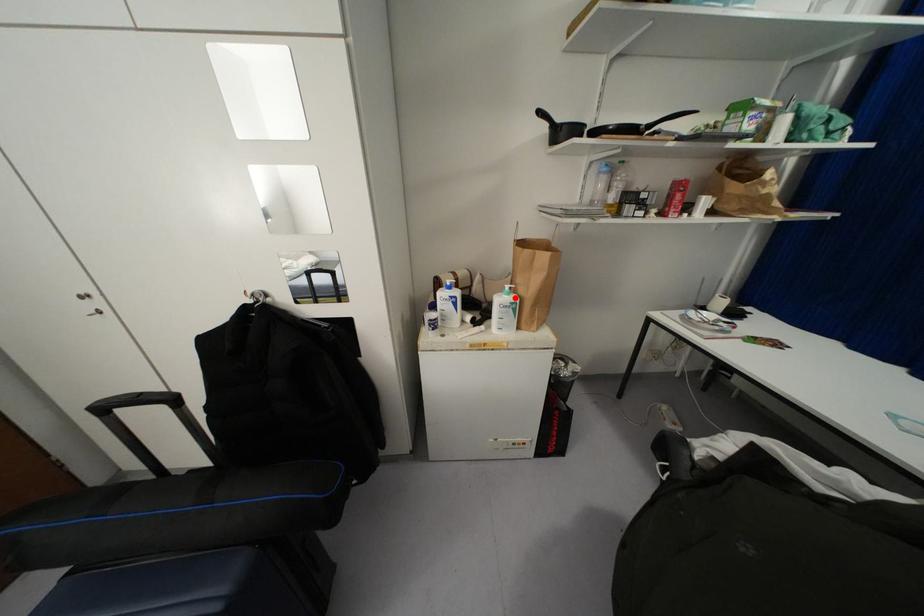
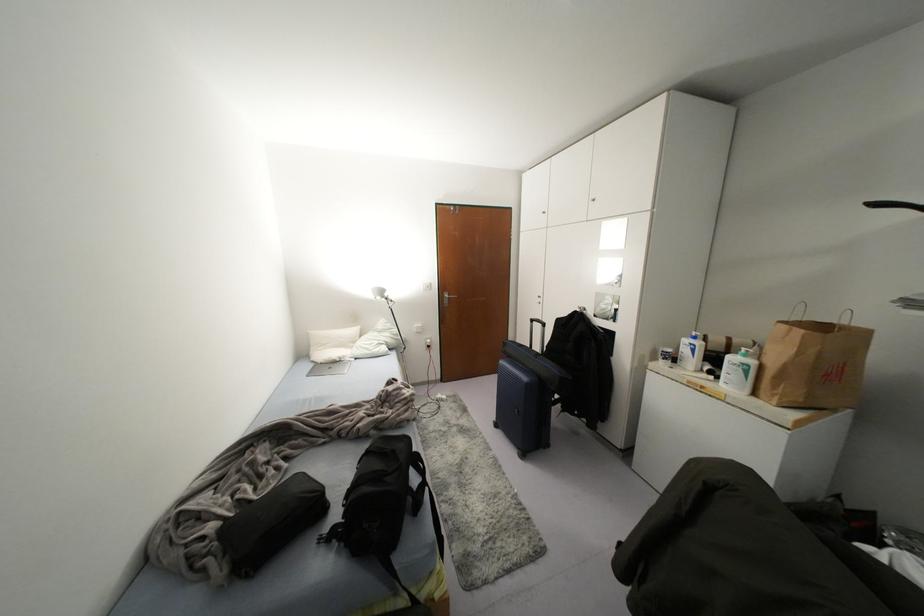
Locate, in the second image, the point that corresponds to the highlighted location in the first image.

(751, 362)